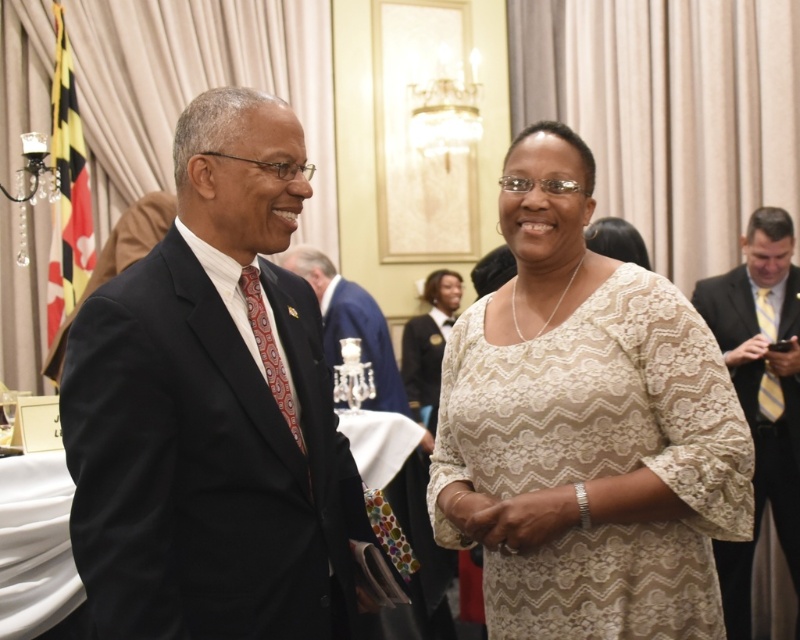
Does point (740, 358) come in front of point (370, 346)?

Yes, it is in front of point (370, 346).

Does yellow striped tie at right appear on the left side of matte black suit at center?

No, yellow striped tie at right is not to the left of matte black suit at center.

Is point (774, 452) more distant than point (310, 282)?

No.

In order to click on yellow striped tie at right in this screenshot , I will do 760,394.

Does dark blue suit at center have a greater width compared to lace dress at center?

No.

You are a GUI agent. You are given a task and a screenshot of the screen. Output one action in this format:
    pyautogui.click(x=<x>, y=<y>)
    Task: Click on the dark blue suit at center
    The image size is (800, 640).
    Given the screenshot: What is the action you would take?
    pyautogui.click(x=214, y=408)

Image resolution: width=800 pixels, height=640 pixels. In order to click on dark blue suit at center in this screenshot , I will do `click(214, 408)`.

Can you confirm if dark blue suit at center is smaller than yellow striped tie at right?

Incorrect, dark blue suit at center is not smaller in size than yellow striped tie at right.

Does dark blue suit at center appear on the left side of yellow striped tie at right?

Correct, you'll find dark blue suit at center to the left of yellow striped tie at right.

Locate an element on the screen. dark blue suit at center is located at coordinates (214, 408).